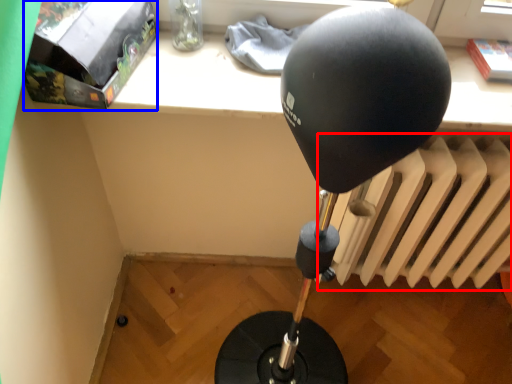
Question: Among these objects, which one is nearest to the camera, radiator (highlighted by a red box) or package (highlighted by a blue box)?

Choices:
 (A) radiator
 (B) package

Answer: (B)